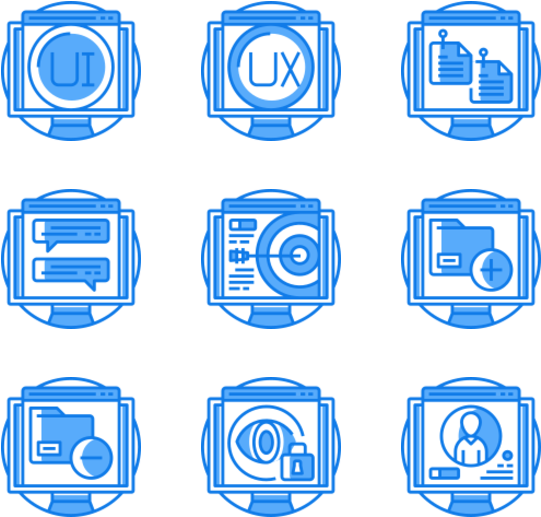
Where is `drawn screens with different designs`? drawn screens with different designs is located at coordinates (274, 456), (84, 440), (453, 446), (452, 275), (306, 276), (71, 273), (243, 74), (437, 67), (69, 55).